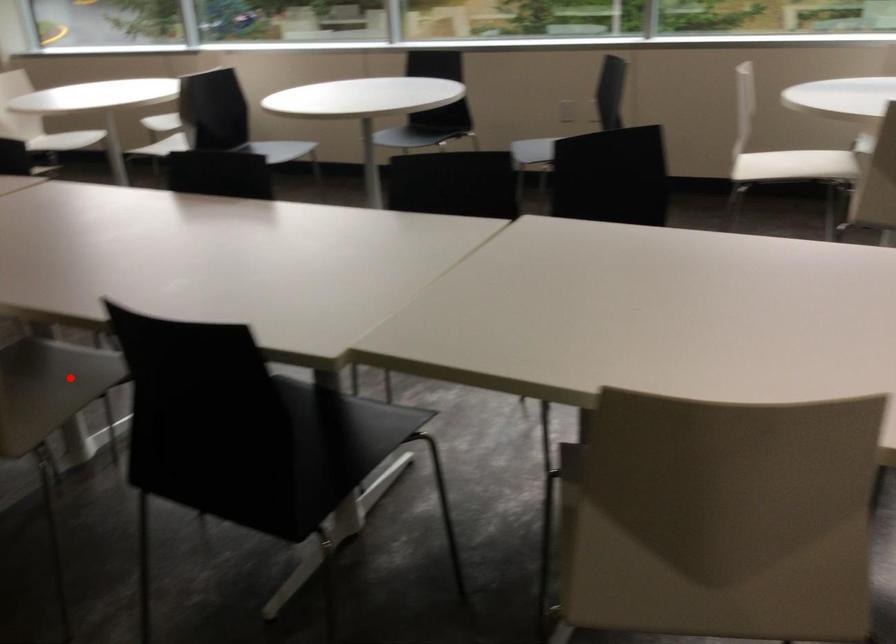
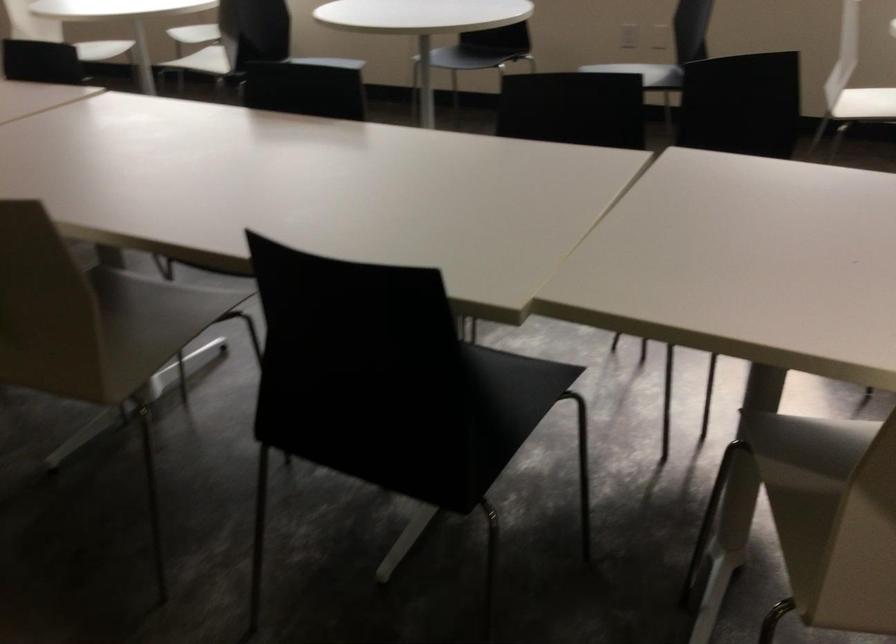
Question: I am providing you with two images of the same scene from different viewpoints. Image1 has a red point marked. In image2, the corresponding 3D location appears at what relative position? Reply with the corresponding letter.

Choices:
 (A) Closer
 (B) Farther

Answer: (A)